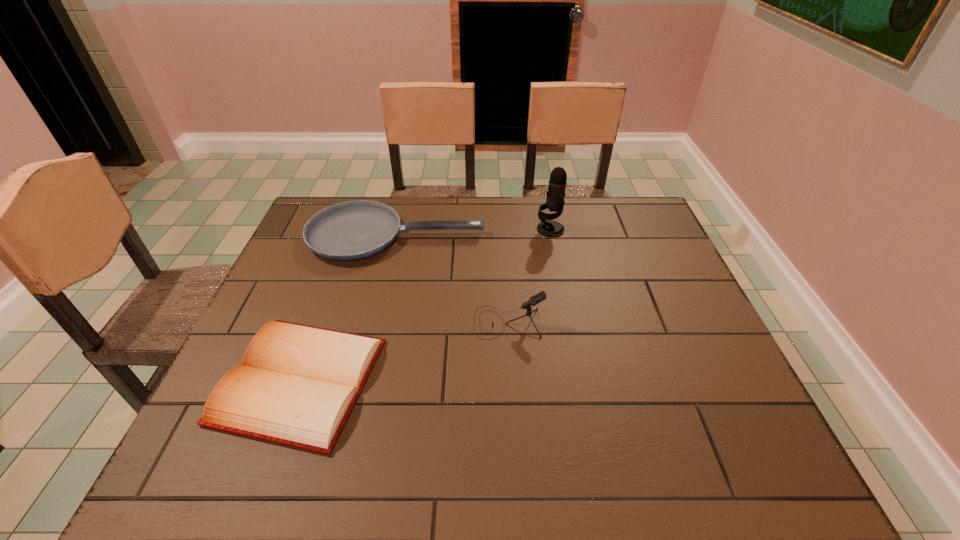
Find the location of a particular element. The height and width of the screenshot is (540, 960). free space at the near edge of the desktop is located at coordinates (432, 472).

The height and width of the screenshot is (540, 960). Find the location of `free location at the left edge`. free location at the left edge is located at coordinates (304, 261).

Locate an element on the screen. vacant space at the right edge is located at coordinates (639, 264).

You are a GUI agent. You are given a task and a screenshot of the screen. Output one action in this format:
    pyautogui.click(x=<x>, y=<y>)
    Task: Click on the vacant space at the far right corner
    The width and height of the screenshot is (960, 540).
    Given the screenshot: What is the action you would take?
    pyautogui.click(x=610, y=215)

In the image, there is a desktop. Identify the location of free space at the near right corner. (758, 449).

Locate an element on the screen. free space between the farther microphone and the shorter microphone is located at coordinates (529, 276).

Locate an element on the screen. free area in between the right microphone and the Bible is located at coordinates (425, 305).

What are the coordinates of `vacant area between the tallest object and the Bible` in the screenshot? It's located at (425, 305).

Locate an element on the screen. This screenshot has width=960, height=540. free spot between the frying pan and the nearer microphone is located at coordinates (452, 279).

I want to click on vacant space in between the farther microphone and the Bible, so click(x=425, y=305).